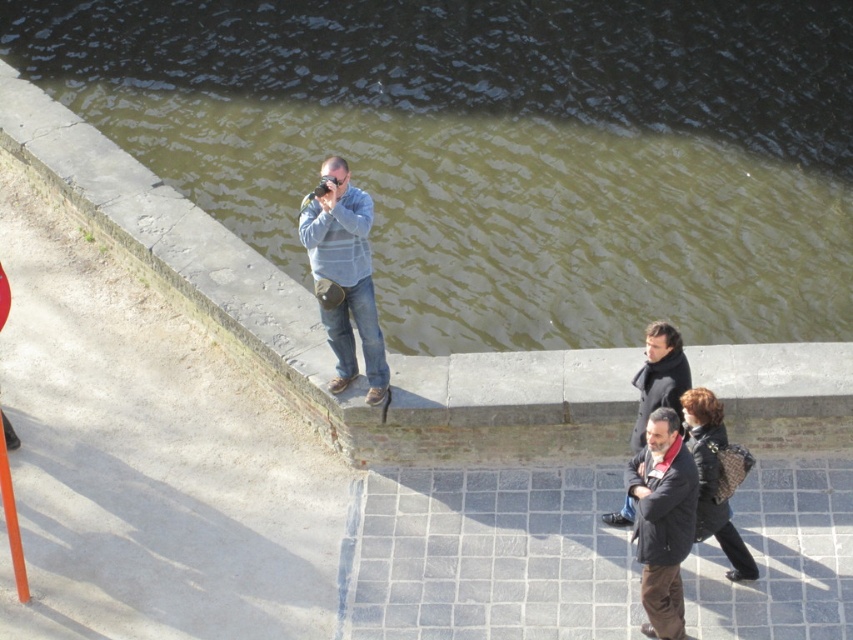
Question: Which point appears farthest from the camera in this image?

Choices:
 (A) (709, 492)
 (B) (654, 611)
 (C) (653, 385)

Answer: (C)

Question: Which of these objects is positioned farthest from the greenish water at upper center?

Choices:
 (A) black textured coat at lower right
 (B) light blue sweater at center
 (C) dark gray wool coat at lower right

Answer: (C)

Question: Does dark brown leather jacket at lower right have a smaller size compared to black textured coat at lower right?

Choices:
 (A) no
 (B) yes

Answer: (B)

Question: Does greenish water at upper center come behind light blue sweater at center?

Choices:
 (A) yes
 (B) no

Answer: (A)

Question: Which is farther from the light blue sweater at center?

Choices:
 (A) black textured coat at lower right
 (B) dark brown leather jacket at lower right

Answer: (A)

Question: Does light blue sweater at center have a larger size compared to dark gray wool coat at lower right?

Choices:
 (A) yes
 (B) no

Answer: (A)